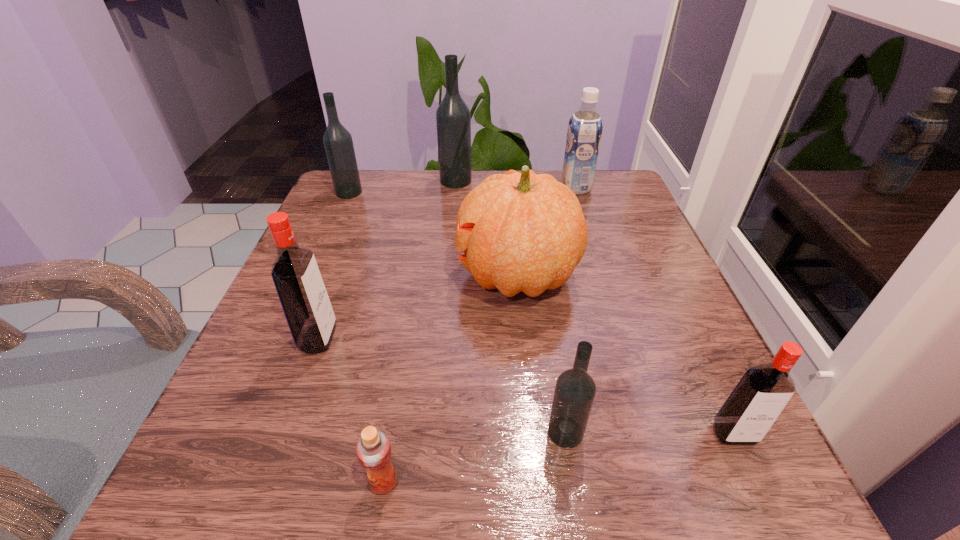
Where is `the second black vodka from left to right`? This screenshot has height=540, width=960. the second black vodka from left to right is located at coordinates (453, 119).

Find the location of a particular element. the third vodka from right to left is located at coordinates (453, 119).

Where is `the second object from right to left`? the second object from right to left is located at coordinates (585, 126).

Identify the location of orange pumpkin. The width and height of the screenshot is (960, 540). (524, 232).

Find the location of a particular element. pumpkin is located at coordinates pos(524,232).

The width and height of the screenshot is (960, 540). I want to click on the second smallest black vodka, so click(x=338, y=143).

Locate an element on the screen. The height and width of the screenshot is (540, 960). the left red vodka is located at coordinates (295, 273).

Find the location of `the third nearest vodka`. the third nearest vodka is located at coordinates pyautogui.click(x=295, y=273).

In order to click on the nearest black vodka in this screenshot , I will do `click(575, 390)`.

Identify the location of the smallest black vodka. The height and width of the screenshot is (540, 960). (575, 390).